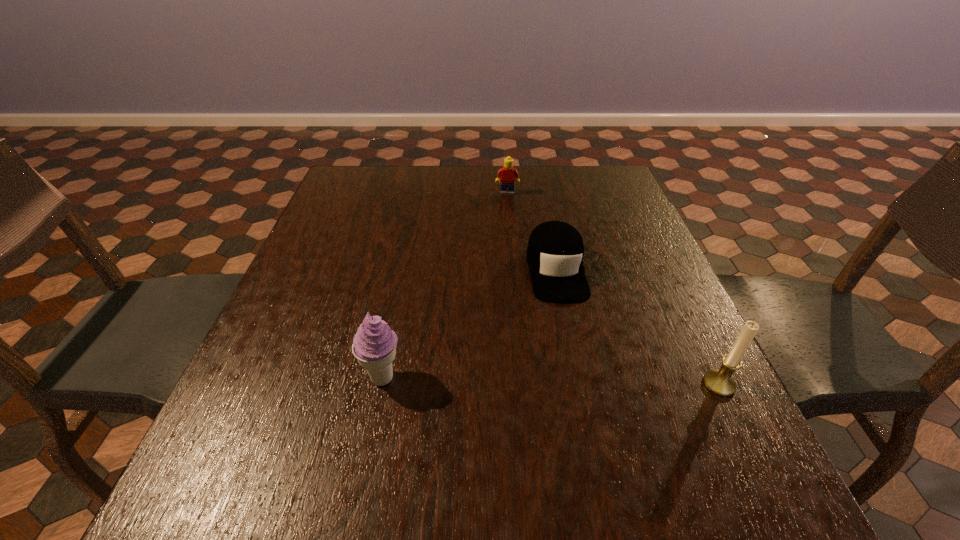
Find the location of `vacant point located between the third nearest object and the candle holder`. vacant point located between the third nearest object and the candle holder is located at coordinates (637, 327).

You are a GUI agent. You are given a task and a screenshot of the screen. Output one action in this format:
    pyautogui.click(x=<x>, y=<y>)
    Task: Click on the vacant area that lies between the rightmost object and the third nearest object
    Image resolution: width=960 pixels, height=540 pixels.
    Given the screenshot: What is the action you would take?
    pyautogui.click(x=637, y=327)

You are a GUI agent. You are given a task and a screenshot of the screen. Output one action in this format:
    pyautogui.click(x=<x>, y=<y>)
    Task: Click on the free space between the candle holder and the leftmost object
    This screenshot has height=540, width=960.
    Given the screenshot: What is the action you would take?
    pyautogui.click(x=551, y=381)

The image size is (960, 540). What are the coordinates of `empty location between the cap and the candle holder` in the screenshot? It's located at (637, 327).

The image size is (960, 540). Find the location of `object that stands as the second closest to the farthest object`. object that stands as the second closest to the farthest object is located at coordinates (374, 345).

Point out which object is positioned as the third nearest to the rightmost object. Please provide its 2D coordinates. Your answer should be formatted as a tuple, i.e. [(x, y)], where the tuple contains the x and y coordinates of a point satisfying the conditions above.

[(507, 174)]

The height and width of the screenshot is (540, 960). In order to click on free point that satisfies the following two spatial constraints: 1. on the back side of the second shortest object; 2. on the right side of the icecream in this screenshot , I will do `click(420, 193)`.

At what (x,y) coordinates should I click in order to perform the action: click on vacant space that satisfies the following two spatial constraints: 1. on the front side of the rightmost object; 2. on the left side of the farthest object. Please return your answer as a coordinate pair (x, y). Looking at the image, I should click on (524, 384).

Find the location of `vacant region that satisfies the following two spatial constraints: 1. on the back side of the cap; 2. on the right side of the icecream`. vacant region that satisfies the following two spatial constraints: 1. on the back side of the cap; 2. on the right side of the icecream is located at coordinates (404, 269).